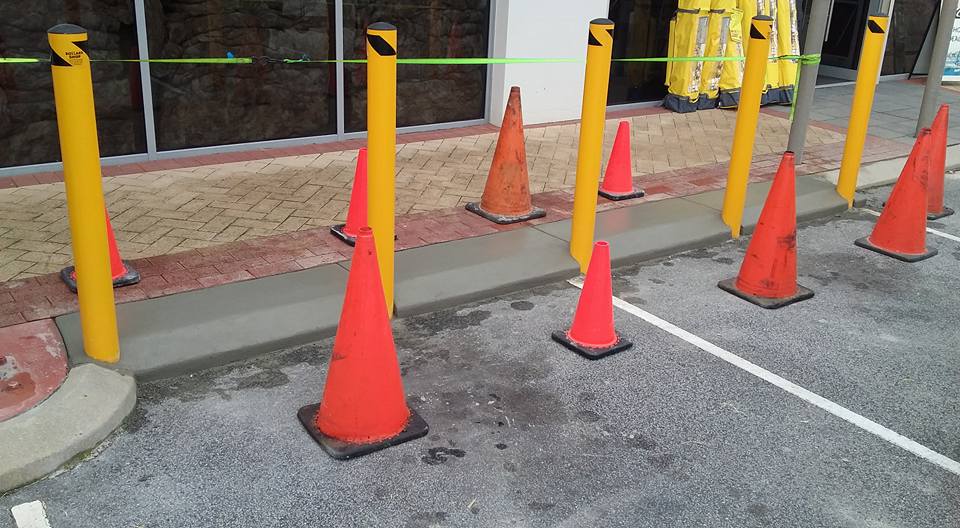
Find the location of a particular element. windows is located at coordinates (111, 100), (269, 106), (456, 91), (846, 45), (903, 55), (616, 78).